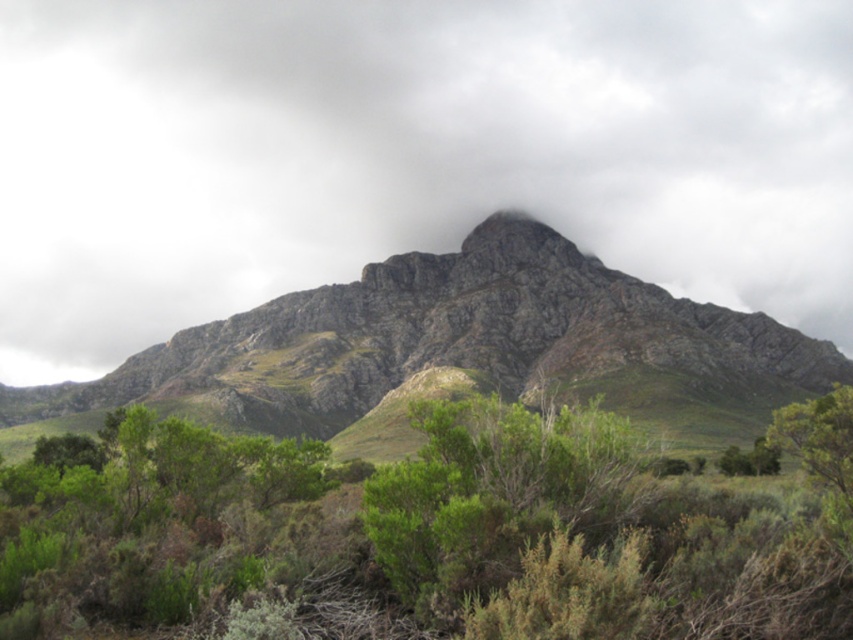
Question: In this image, where is white fluffy cloud at center located relative to green leafy shrub at center?

Choices:
 (A) above
 (B) below

Answer: (A)

Question: Which object is positioned farthest from the rugged rock mountain at center?

Choices:
 (A) green leafy shrub at center
 (B) white fluffy cloud at center

Answer: (B)

Question: Which object is the closest to the white fluffy cloud at center?

Choices:
 (A) green leafy shrub at center
 (B) rugged rock mountain at center

Answer: (B)

Question: Does rugged rock mountain at center lie in front of green leafy shrub at center?

Choices:
 (A) yes
 (B) no

Answer: (B)

Question: Can you confirm if rugged rock mountain at center is positioned to the right of green leafy shrub at center?

Choices:
 (A) no
 (B) yes

Answer: (A)

Question: Which object is closer to the camera taking this photo?

Choices:
 (A) white fluffy cloud at center
 (B) green leafy shrub at center
 (C) rugged rock mountain at center

Answer: (B)